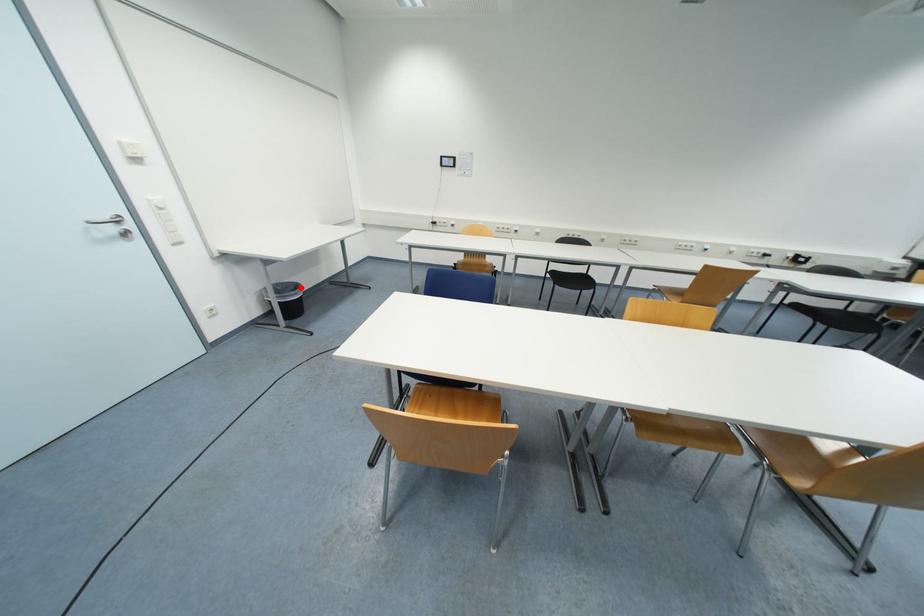
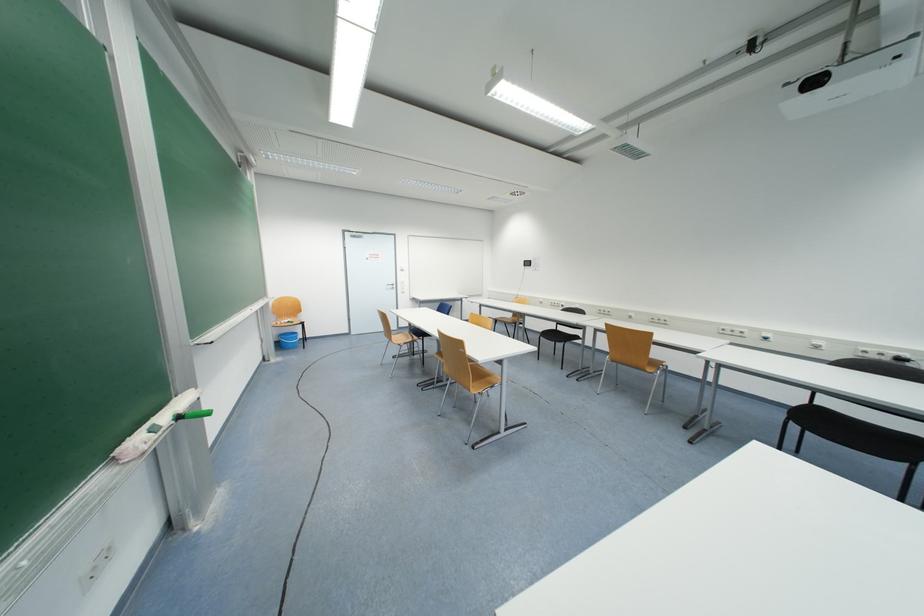
Question: I am providing you with two images of the same scene from different viewpoints. A red point is marked on the first image. Is the red point's position out of view in image 2?

Choices:
 (A) Yes
 (B) No

Answer: (A)